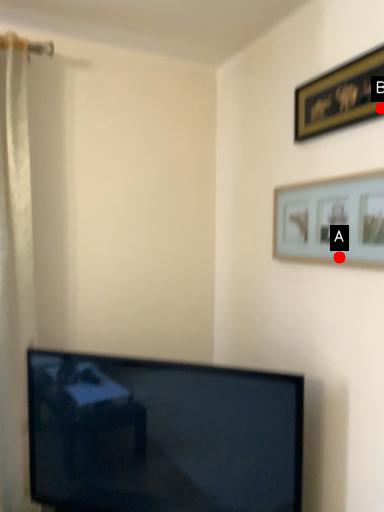
Question: Two points are circled on the image, labeled by A and B beside each circle. Which point is closer to the camera?

Choices:
 (A) A is closer
 (B) B is closer

Answer: (B)